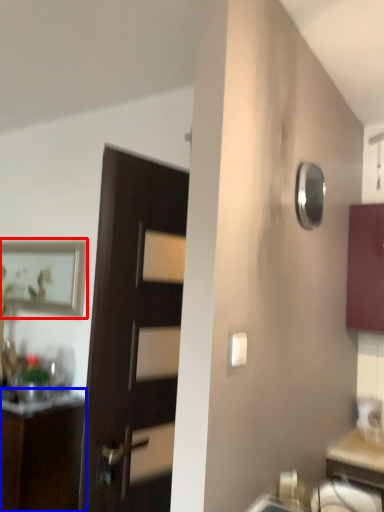
Question: Among these objects, which one is nearest to the camera, picture frame (highlighted by a red box) or cabinetry (highlighted by a blue box)?

Choices:
 (A) picture frame
 (B) cabinetry

Answer: (B)